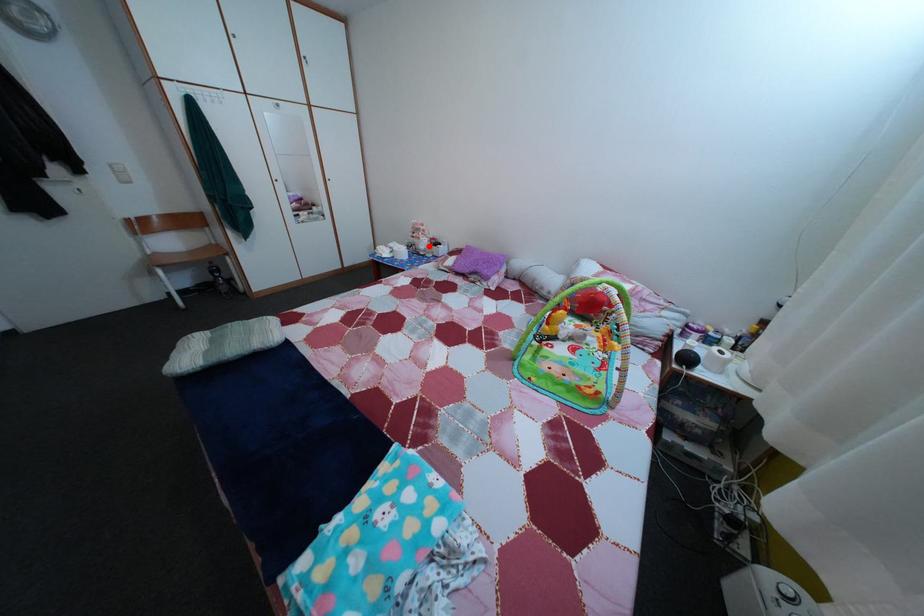
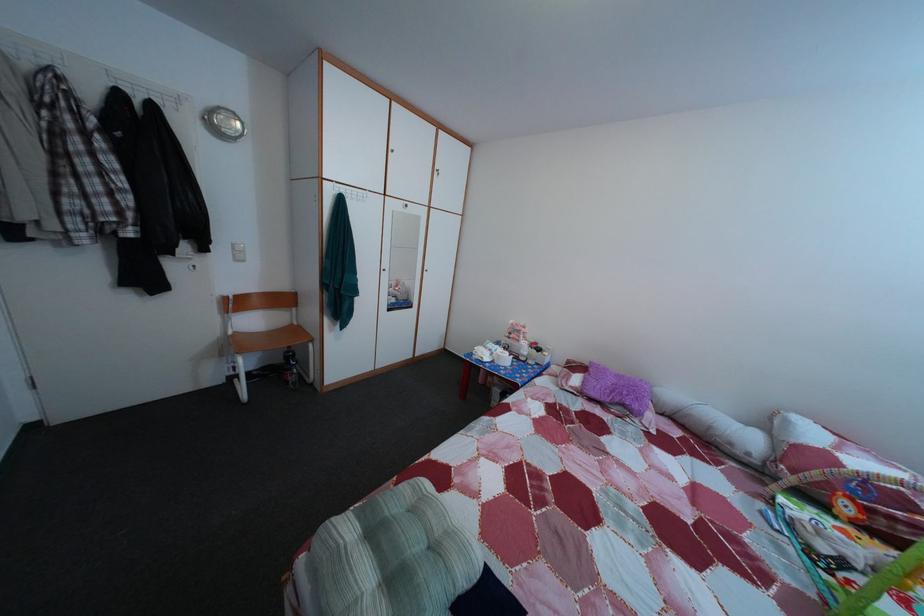
Question: I am providing you with two images of the same scene from different viewpoints. A red point is marked on the first image. At the location where the point appears in image 1, is it still visible in image 2?

Choices:
 (A) Yes
 (B) No

Answer: (A)